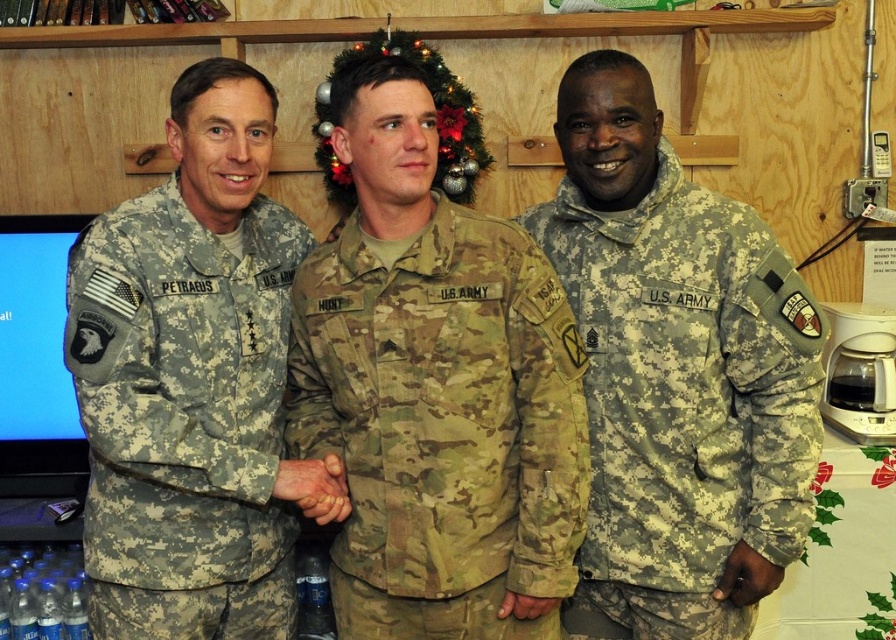
In the scene shown: You are a photographer trying to capture a group photo of the three individuals in the scene. You want to ensure that the camouflage fabric uniform at center is positioned exactly at the center of the frame. Given its current coordinates at point 0.666 on the x and 0.494 on the y, how far off is it from the true center of the frame?

The camouflage fabric uniform at center is currently at coordinates 0.666 on the x and 0.494 on the y. The true center of the frame is at coordinates 0.5 on both axes. Therefore, it is 0.166 units off on the x and 0.006 units off on the y from the true center.

In the scene shown: You are a photographer trying to capture a photo of the three soldiers in the scene. You notice a specific point at coordinates point (674, 369). Based on the description, which soldier is this point located on?

The point (674, 369) is on the camouflage uniform of the soldier labeled HUNT at center.

You are a photographer standing 1.5 meters away from the camouflage fabric uniform at center. Can you take a clear photo of it without moving closer?

The camouflage fabric uniform at center is 1.41 meters from the viewer, which is within the 1.5 meters distance you mentioned. Therefore, you can take a clear photo without moving closer.